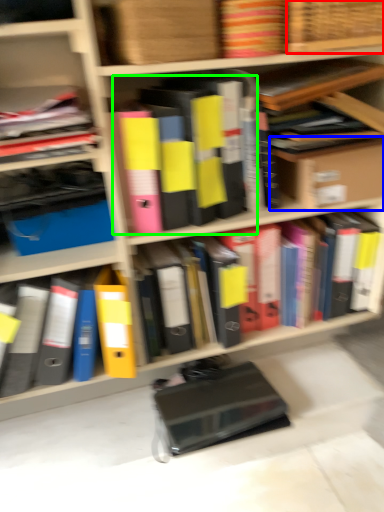
Question: Which object is positioned farthest from basket (highlighted by a red box)? Select from cardboard box (highlighted by a blue box) and book (highlighted by a green box).

Choices:
 (A) cardboard box
 (B) book

Answer: (A)